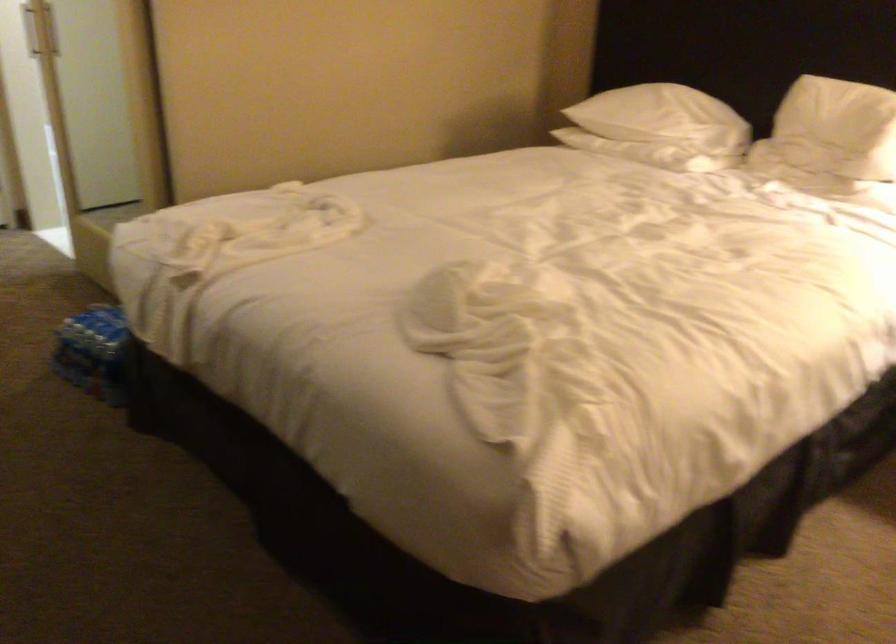
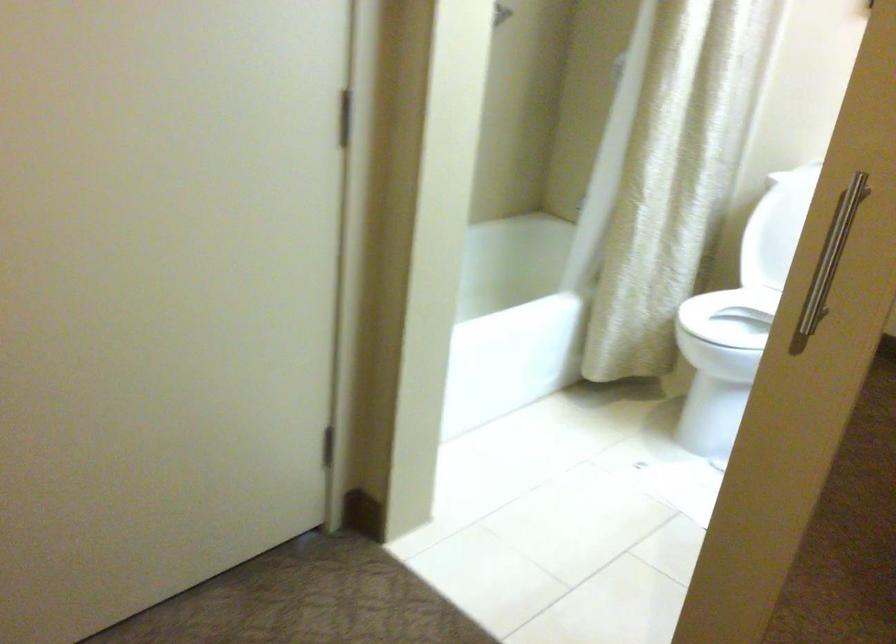
The images are taken continuously from a first-person perspective. In which direction are you moving?

The cameraman moved toward left, forward.